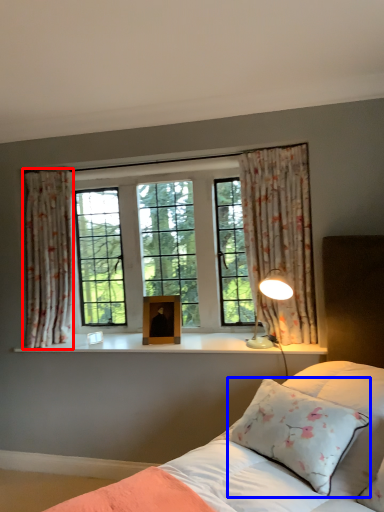
Question: Among these objects, which one is nearest to the camera, curtain (highlighted by a red box) or pillow (highlighted by a blue box)?

Choices:
 (A) curtain
 (B) pillow

Answer: (B)